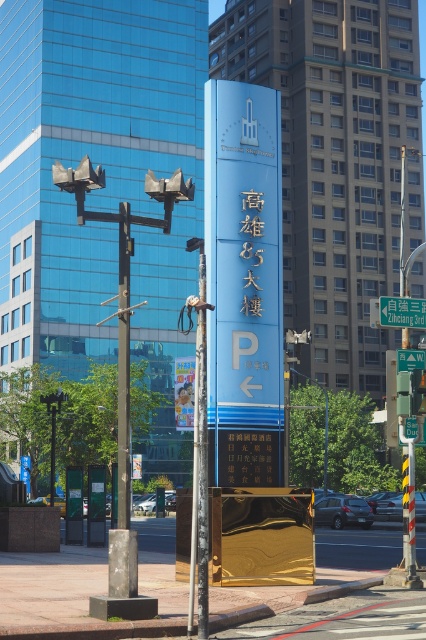
Can you confirm if metallic pole at center is thinner than blue metallic street sign at center?

Correct, metallic pole at center's width is less than blue metallic street sign at center's.

Is point (198, 480) in front of point (408, 316)?

Yes.

Identify the location of metallic pole at center. (199, 456).